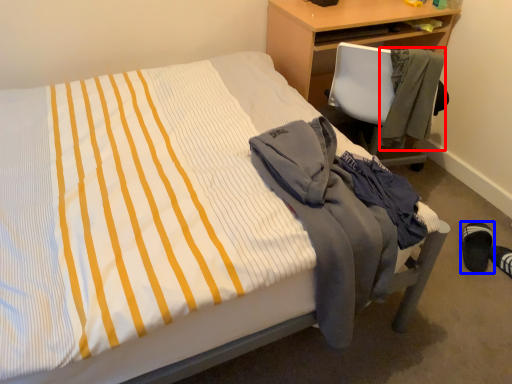
Question: Which of the following is the closest to the observer, jacket (highlighted by a red box) or footwear (highlighted by a blue box)?

Choices:
 (A) jacket
 (B) footwear

Answer: (A)